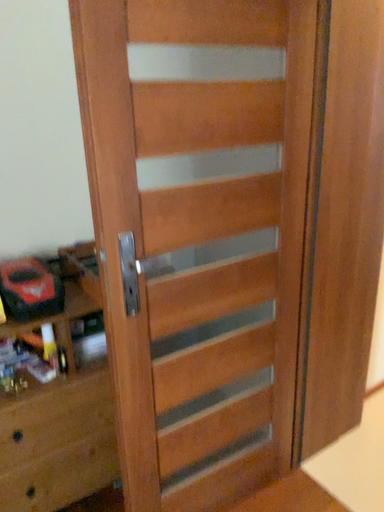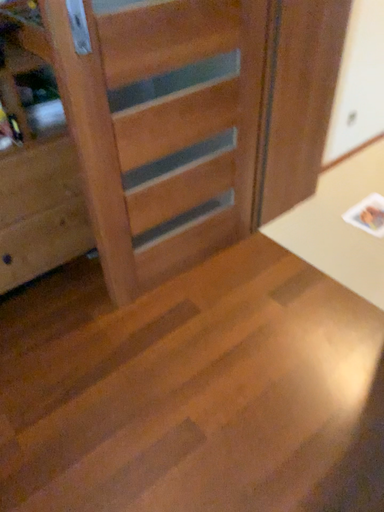
Question: Which way did the camera rotate in the video?

Choices:
 (A) rotated upward
 (B) rotated downward

Answer: (B)